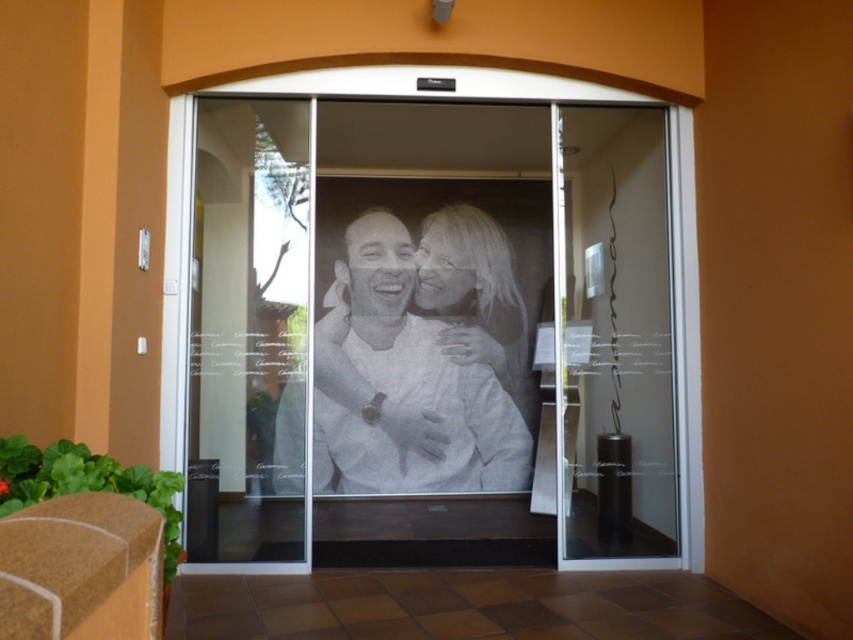
You are a delivery person trying to enter through the entrance shown in the image. You see a point at coordinates (445, 323). Is this point located on the transparent glass screen door at center?

Yes, the point at coordinates (445, 323) is located on the transparent glass screen door at center as indicated by the description.

You are standing in front of the entrance and want to enter the building. Which door should you go through first, the transparent glass screen door at center or the transparent glass door at center?

You should go through the transparent glass screen door at center first since it is closer to you than the transparent glass door at center, which is further back.